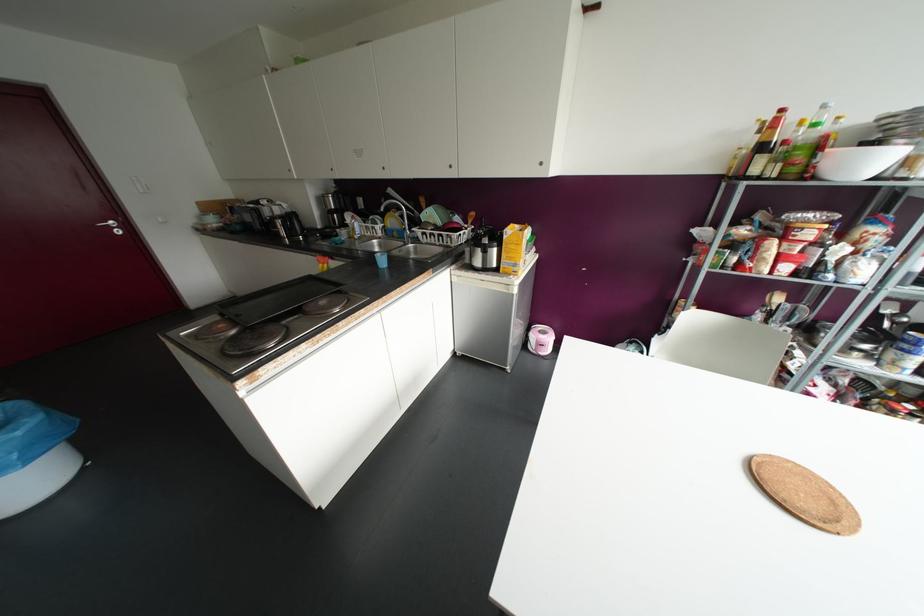
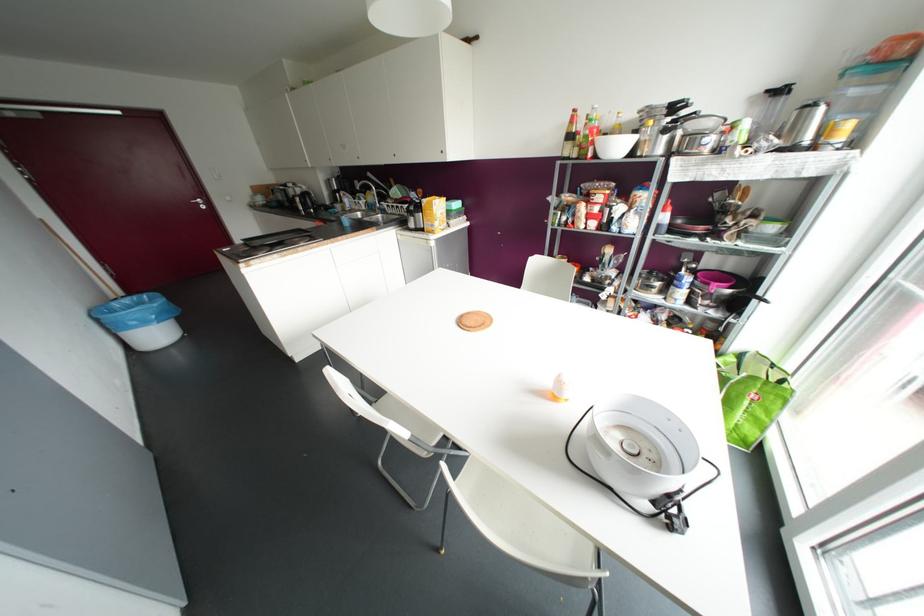
Where in the second image is the point corresponding to point (117, 232) from the first image?

(202, 207)